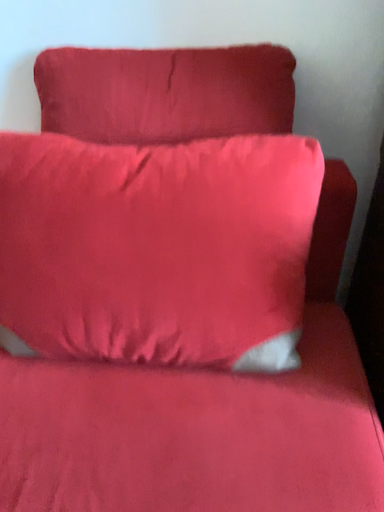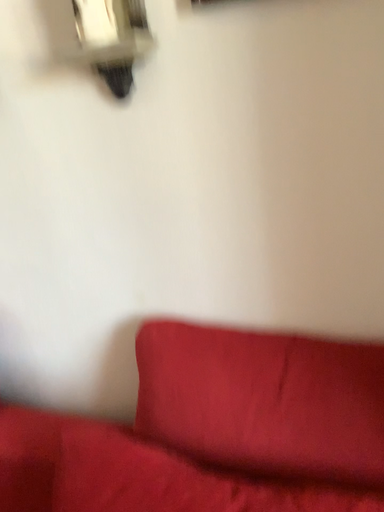
Question: Which way did the camera rotate in the video?

Choices:
 (A) rotated right
 (B) rotated left

Answer: (B)